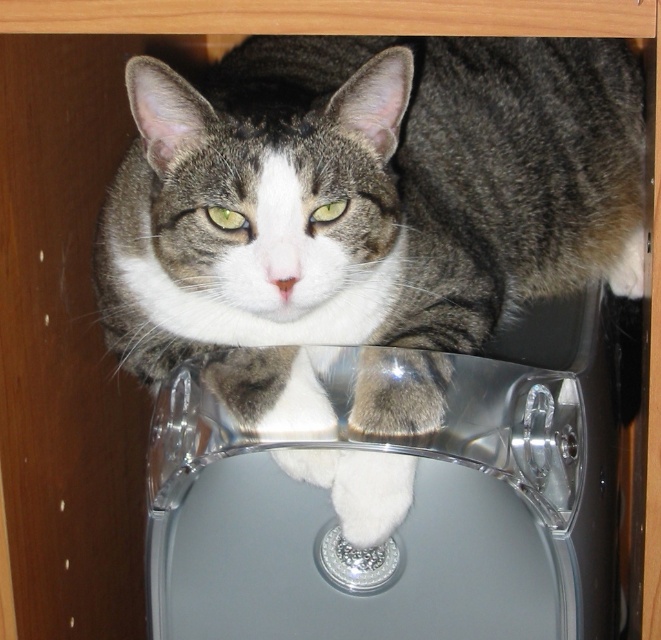
You are a pet sitter who needs to clean the clear plastic sink at center. The tabby fur cat at center is resting there. Can you clean the sink without disturbing the cat?

The tabby fur cat at center is above the clear plastic sink at center, so you need to move the cat before cleaning the sink.

You need to place a small toy that is 10 cm tall on the clear plastic sink at center without it falling off. Considering the height of the tabby fur cat at center, is the toy safe from the cat reaching it?

The tabby fur cat at center is much taller than the clear plastic sink at center, so the cat can easily reach the toy placed on the clear plastic sink at center. The toy is not safe from the cat reaching it.